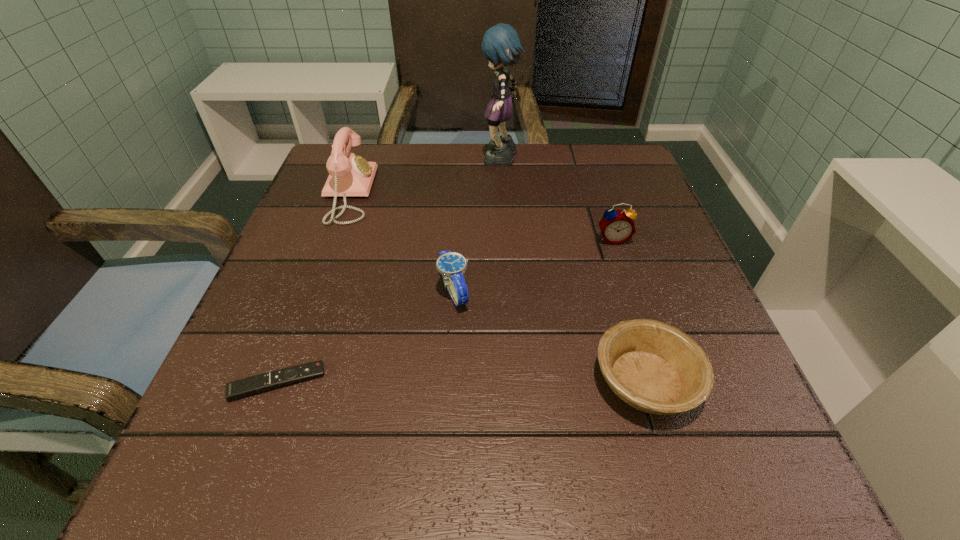
Find the location of a particular element. This screenshot has height=540, width=960. the tallest object is located at coordinates (501, 45).

This screenshot has width=960, height=540. Find the location of `rag doll`. rag doll is located at coordinates (501, 45).

The width and height of the screenshot is (960, 540). I want to click on telephone, so click(x=349, y=175).

Find the location of `the third tallest object`. the third tallest object is located at coordinates (617, 226).

Where is `the third farthest object`? This screenshot has height=540, width=960. the third farthest object is located at coordinates (617, 226).

Where is `the third shortest object`? the third shortest object is located at coordinates (452, 266).

Find the location of `watch`. watch is located at coordinates (x=452, y=266).

Identify the location of bowl. (656, 368).

This screenshot has height=540, width=960. In order to click on remote control in this screenshot , I will do `click(249, 386)`.

You are a GUI agent. You are given a task and a screenshot of the screen. Output one action in this format:
    pyautogui.click(x=<x>, y=<y>)
    Task: Click on the vacant space situated on the front-facing side of the tallest object
    
    Given the screenshot: What is the action you would take?
    pyautogui.click(x=383, y=161)